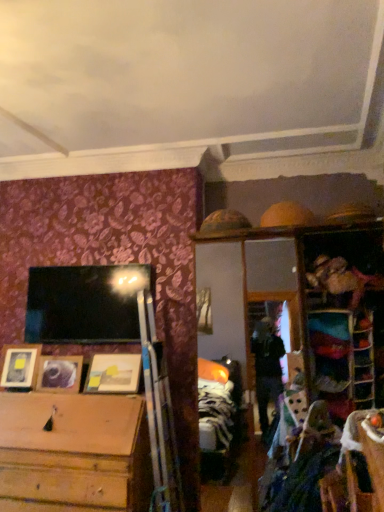
Question: Can you confirm if metallic reflective frame at upper right, the second shelf when ordered from right to left, is positioned to the right of wooden picture frame at center, which ranks as the third picture frame in left-to-right order?

Choices:
 (A) yes
 (B) no

Answer: (A)

Question: Considering the relative sizes of metallic reflective frame at upper right, which is the first shelf from left to right, and wooden picture frame at center, placed as the first picture frame when sorted from right to left, in the image provided, is metallic reflective frame at upper right, which is the first shelf from left to right, taller than wooden picture frame at center, placed as the first picture frame when sorted from right to left,?

Choices:
 (A) no
 (B) yes

Answer: (B)

Question: Is metallic reflective frame at upper right, which is the first shelf from left to right, looking in the opposite direction of wooden picture frame at center, placed as the first picture frame when sorted from right to left?

Choices:
 (A) yes
 (B) no

Answer: (B)

Question: Is metallic reflective frame at upper right, which is the first shelf from left to right, outside wooden picture frame at center, placed as the first picture frame when sorted from right to left?

Choices:
 (A) yes
 (B) no

Answer: (A)

Question: Is metallic reflective frame at upper right, which is the first shelf from left to right, bigger than wooden picture frame at center, placed as the first picture frame when sorted from right to left?

Choices:
 (A) no
 (B) yes

Answer: (A)

Question: Is wooden picture frame at center, placed as the first picture frame when sorted from right to left, inside or outside of wooden picture frame at lower left, which is counted as the third picture frame, starting from the right?

Choices:
 (A) inside
 (B) outside

Answer: (B)

Question: From the image's perspective, is wooden picture frame at center, placed as the first picture frame when sorted from right to left, located above or below wooden picture frame at lower left, which is counted as the third picture frame, starting from the right?

Choices:
 (A) below
 (B) above

Answer: (B)

Question: In terms of width, does wooden picture frame at center, placed as the first picture frame when sorted from right to left, look wider or thinner when compared to wooden picture frame at lower left, which appears as the 1th picture frame when viewed from the left?

Choices:
 (A) wide
 (B) thin

Answer: (A)

Question: Is wooden picture frame at center, which ranks as the third picture frame in left-to-right order, bigger or smaller than wooden picture frame at lower left, which appears as the 1th picture frame when viewed from the left?

Choices:
 (A) small
 (B) big

Answer: (B)

Question: Considering the positions of wooden picture frame at left, which is the 2th picture frame in right-to-left order, and wooden shelf at right, which is the second shelf in left-to-right order, in the image, is wooden picture frame at left, which is the 2th picture frame in right-to-left order, bigger or smaller than wooden shelf at right, which is the second shelf in left-to-right order,?

Choices:
 (A) small
 (B) big

Answer: (B)

Question: Considering the relative positions of wooden picture frame at left, which is the 2th picture frame in right-to-left order, and wooden shelf at right, which is the second shelf in left-to-right order, in the image provided, is wooden picture frame at left, which is the 2th picture frame in right-to-left order, to the left or to the right of wooden shelf at right, which is the second shelf in left-to-right order,?

Choices:
 (A) right
 (B) left

Answer: (B)

Question: Considering the positions of wooden picture frame at left, the second picture frame viewed from the left, and wooden shelf at right, which is the first shelf from right to left, in the image, is wooden picture frame at left, the second picture frame viewed from the left, taller or shorter than wooden shelf at right, which is the first shelf from right to left,?

Choices:
 (A) tall
 (B) short

Answer: (B)

Question: Considering the positions of wooden picture frame at left, the second picture frame viewed from the left, and wooden shelf at right, which is the first shelf from right to left, in the image, is wooden picture frame at left, the second picture frame viewed from the left, wider or thinner than wooden shelf at right, which is the first shelf from right to left,?

Choices:
 (A) thin
 (B) wide

Answer: (B)

Question: Relative to wooden picture frame at left, the second picture frame viewed from the left, is wooden shelf at right, which is the second shelf in left-to-right order, in front or behind?

Choices:
 (A) front
 (B) behind

Answer: (A)

Question: From the image's perspective, is wooden shelf at right, which is the first shelf from right to left, located above or below wooden picture frame at left, the second picture frame viewed from the left?

Choices:
 (A) above
 (B) below

Answer: (A)